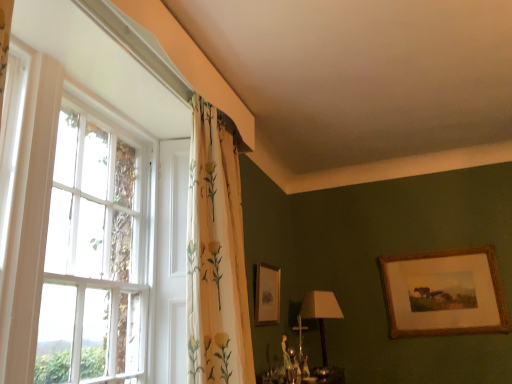
Question: From a real-world perspective, is white floral fabric curtain at upper left above or below gold-framed picture at upper right, positioned as the first picture frame in left-to-right order?

Choices:
 (A) above
 (B) below

Answer: (A)

Question: Considering the positions of white floral fabric curtain at upper left and gold-framed picture at upper right, positioned as the first picture frame in left-to-right order, in the image, is white floral fabric curtain at upper left wider or thinner than gold-framed picture at upper right, positioned as the first picture frame in left-to-right order,?

Choices:
 (A) wide
 (B) thin

Answer: (A)

Question: Considering the real-world distances, which object is farthest from the gold-framed picture at upper right, which is the first picture frame from right to left?

Choices:
 (A) gold-framed picture at upper right, positioned as the first picture frame in left-to-right order
 (B) white wooden window at left
 (C) matte beige lampshade at lower center
 (D) white floral fabric curtain at upper left

Answer: (B)

Question: Estimate the real-world distances between objects in this image. Which object is closer to the matte beige lampshade at lower center?

Choices:
 (A) gold-framed picture at upper right, the second picture frame positioned from the right
 (B) white floral fabric curtain at upper left
 (C) white wooden window at left
 (D) gold-framed picture at upper right, which is the first picture frame from right to left

Answer: (A)